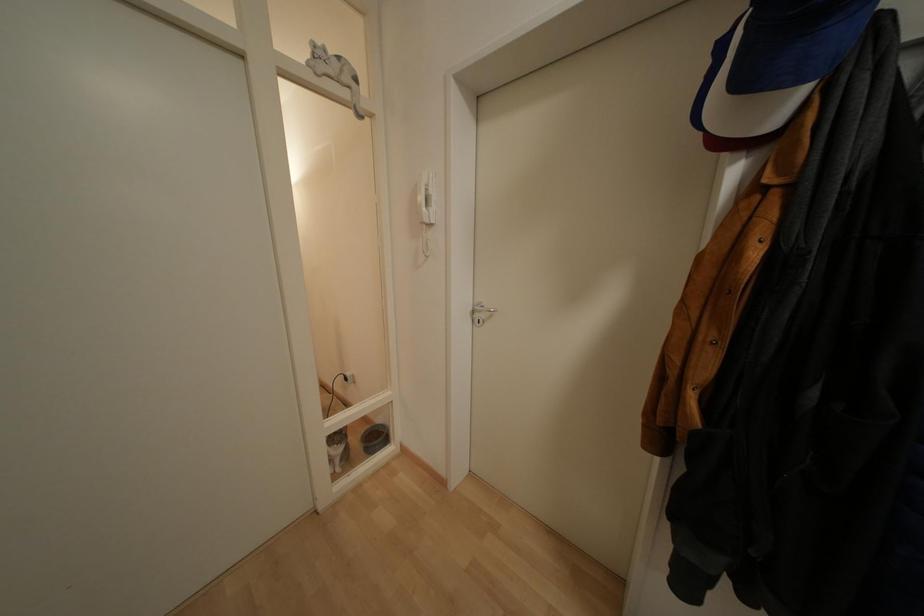
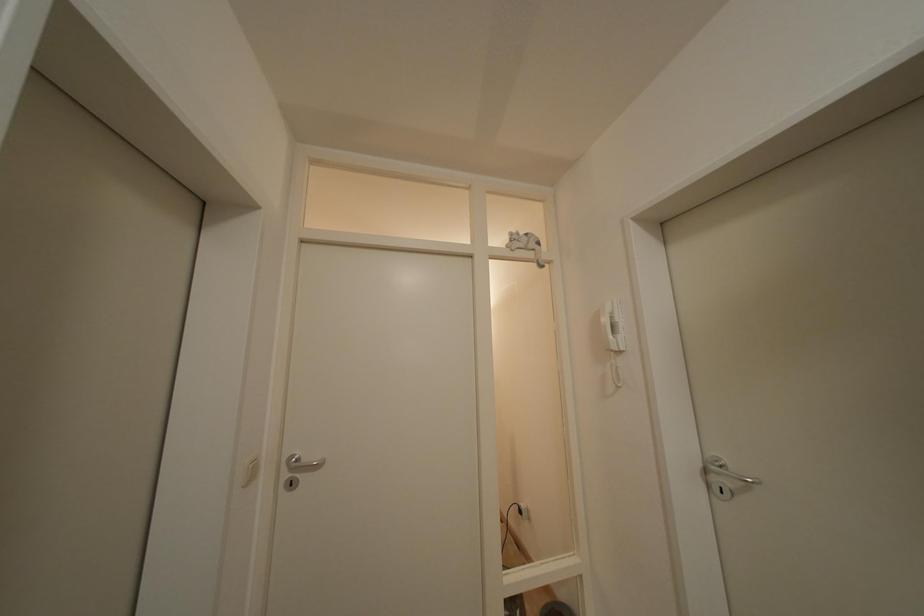
The images are taken continuously from a first-person perspective. In which direction is your viewpoint rotating?

The camera rotated toward left-up.